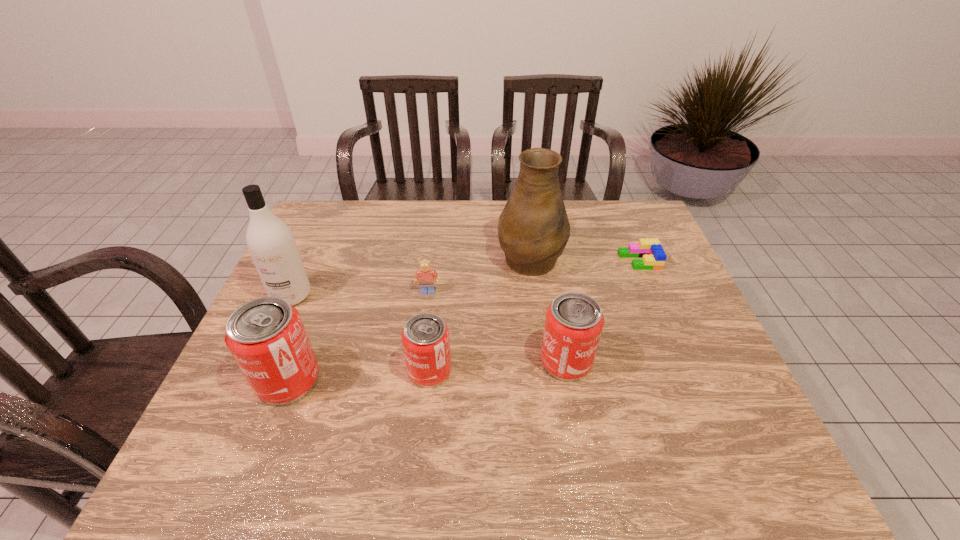
Given the evenly spaced cans in the image, where should an extra can be added on the right to preserve the spacing? Please point to a vacant space. Please provide its 2D coordinates. Your answer should be formatted as a tuple, i.e. [(x, y)], where the tuple contains the x and y coordinates of a point satisfying the conditions above.

[(697, 352)]